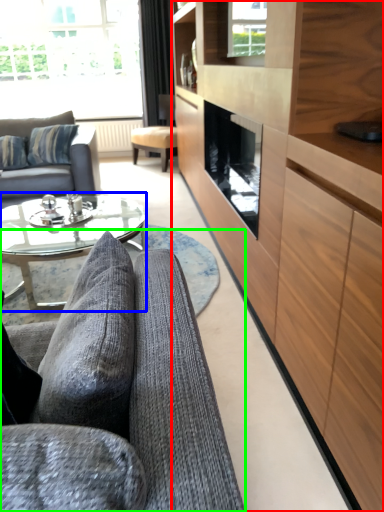
Question: Estimate the real-world distances between objects in this image. Which object is closer to cabinetry (highlighted by a red box), coffee table (highlighted by a blue box) or studio couch (highlighted by a green box)?

Choices:
 (A) coffee table
 (B) studio couch

Answer: (B)